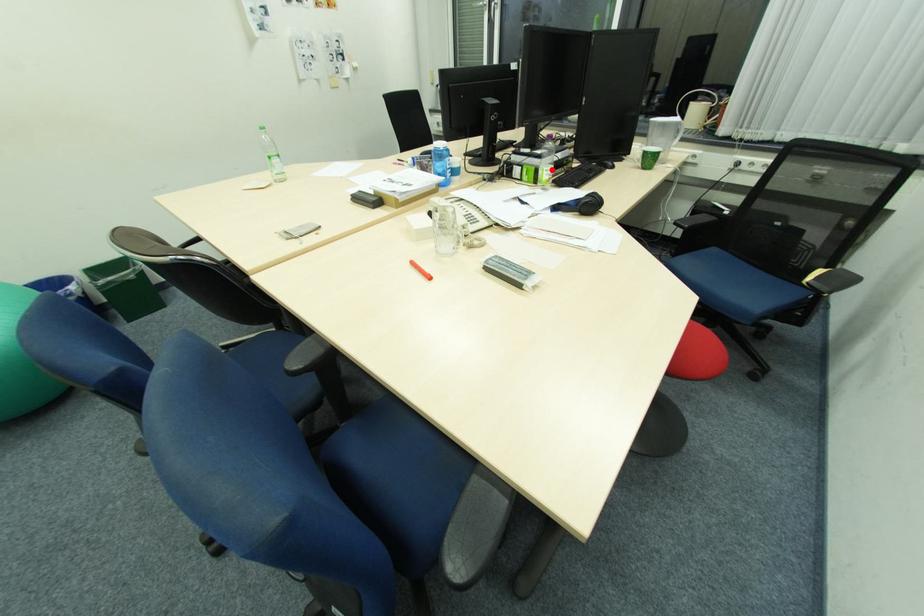
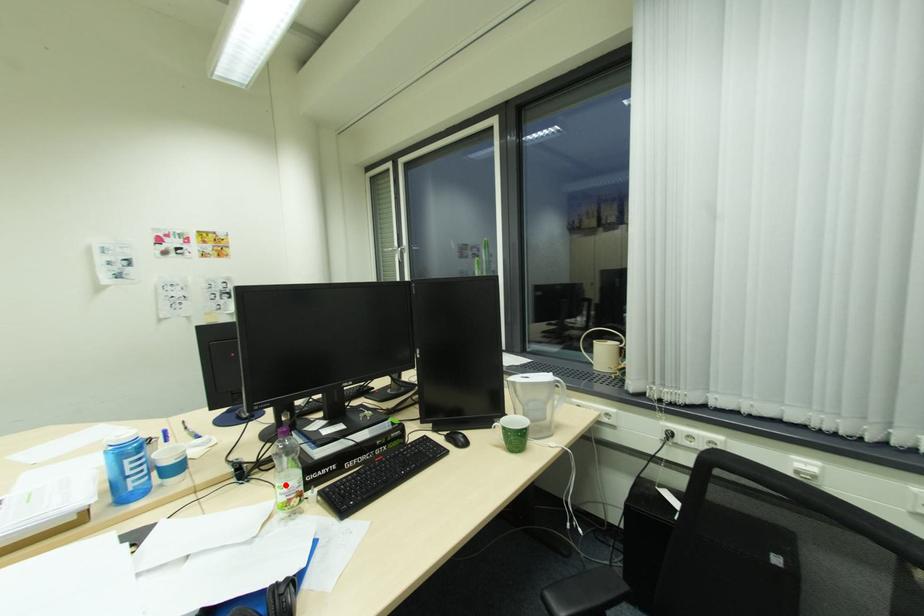
I am providing you with two images of the same scene from different viewpoints. A red point is marked on the first image and another point is marked on the second image. Does the point marked in image1 correspond to the same location as the one in image2?

Yes